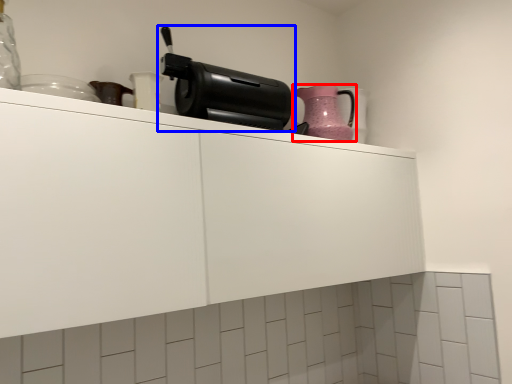
Question: Among these objects, which one is farthest to the camera, kitchen appliance (highlighted by a red box) or home appliance (highlighted by a blue box)?

Choices:
 (A) kitchen appliance
 (B) home appliance

Answer: (A)